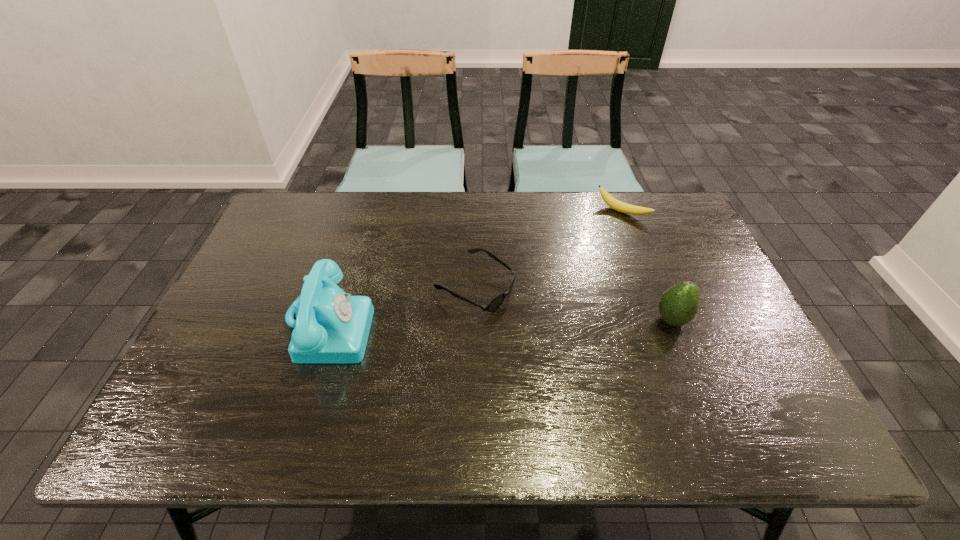
The image size is (960, 540). Find the location of `vacant spot on the desktop that is between the tallest object and the avocado and is positioned on the lenses of the third object from right to left`. vacant spot on the desktop that is between the tallest object and the avocado and is positioned on the lenses of the third object from right to left is located at coordinates (551, 322).

This screenshot has width=960, height=540. I want to click on free space on the desktop that is between the leftmost object and the third shortest object and is positioned on the upward curve of the farthest object, so click(x=523, y=322).